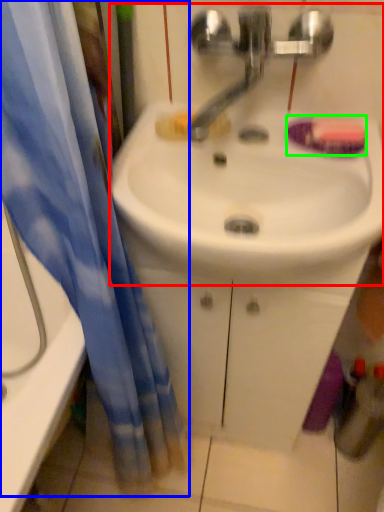
Question: Which object is positioned closest to sink (highlighted by a red box)? Select from curtain (highlighted by a blue box) and soap (highlighted by a green box).

Choices:
 (A) curtain
 (B) soap

Answer: (B)